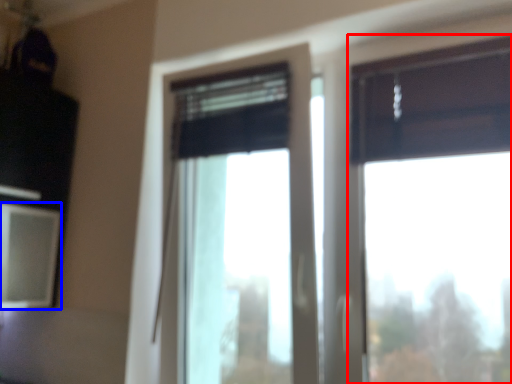
Question: Which point is further to the camera, window (highlighted by a red box) or window screen (highlighted by a blue box)?

Choices:
 (A) window
 (B) window screen

Answer: (B)